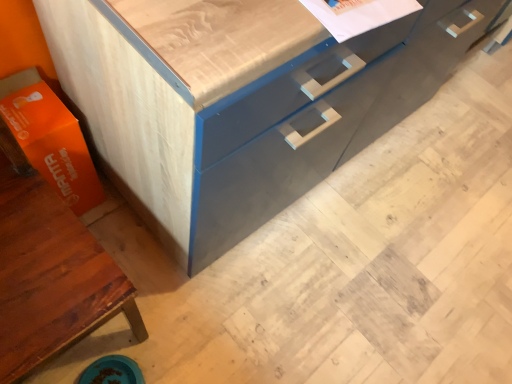
Measure the distance between matte wood cabinet at lower left and camera.

A distance of 28.31 inches exists between matte wood cabinet at lower left and camera.

What do you see at coordinates (242, 109) in the screenshot? I see `matte gray cabinet at center` at bounding box center [242, 109].

Identify the location of orange matte cardboard box at lower left. This screenshot has height=384, width=512. (52, 144).

Considering the sizes of orange matte cardboard box at lower left and matte wood cabinet at lower left in the image, is orange matte cardboard box at lower left bigger or smaller than matte wood cabinet at lower left?

orange matte cardboard box at lower left is smaller than matte wood cabinet at lower left.

Is orange matte cardboard box at lower left aimed at matte wood cabinet at lower left?

No, orange matte cardboard box at lower left is not facing towards matte wood cabinet at lower left.

Considering the relative sizes of orange matte cardboard box at lower left and matte wood cabinet at lower left in the image provided, is orange matte cardboard box at lower left thinner than matte wood cabinet at lower left?

Yes.

In the image, is orange matte cardboard box at lower left on the left side or the right side of matte wood cabinet at lower left?

Clearly, orange matte cardboard box at lower left is on the left of matte wood cabinet at lower left in the image.

Considering the positions of points (42, 81) and (209, 186), is point (42, 81) farther from camera compared to point (209, 186)?

Yes, it is behind point (209, 186).

Can you confirm if orange matte cardboard box at lower left is smaller than matte gray cabinet at center?

Correct, orange matte cardboard box at lower left occupies less space than matte gray cabinet at center.

Is orange matte cardboard box at lower left taller than matte gray cabinet at center?

No, orange matte cardboard box at lower left is not taller than matte gray cabinet at center.

Where is `chest of drawers on the right of orange matte cardboard box at lower left`? The width and height of the screenshot is (512, 384). chest of drawers on the right of orange matte cardboard box at lower left is located at coordinates (242, 109).

From a real-world perspective, is matte gray cabinet at center beneath orange matte cardboard box at lower left?

No, from a real-world perspective, matte gray cabinet at center is not under orange matte cardboard box at lower left.

Considering the sizes of objects matte gray cabinet at center and orange matte cardboard box at lower left in the image provided, who is wider, matte gray cabinet at center or orange matte cardboard box at lower left?

matte gray cabinet at center is wider.

Is matte gray cabinet at center positioned far away from orange matte cardboard box at lower left?

matte gray cabinet at center is actually quite close to orange matte cardboard box at lower left.

Considering the sizes of objects matte wood cabinet at lower left and orange matte cardboard box at lower left in the image provided, who is bigger, matte wood cabinet at lower left or orange matte cardboard box at lower left?

matte wood cabinet at lower left is bigger.

Are matte wood cabinet at lower left and orange matte cardboard box at lower left located far from each other?

No, matte wood cabinet at lower left is not far away from orange matte cardboard box at lower left.

Which object is thinner, matte wood cabinet at lower left or orange matte cardboard box at lower left?

With smaller width is orange matte cardboard box at lower left.

Considering the points (65, 344) and (34, 109), which point is in front, point (65, 344) or point (34, 109)?

The point (65, 344) is in front.

Can you confirm if matte wood cabinet at lower left is bigger than matte gray cabinet at center?

Actually, matte wood cabinet at lower left might be smaller than matte gray cabinet at center.

How different are the orientations of matte wood cabinet at lower left and matte gray cabinet at center in degrees?

They differ by 0.465 degrees in their facing directions.

Considering the relative sizes of matte wood cabinet at lower left and matte gray cabinet at center in the image provided, is matte wood cabinet at lower left wider than matte gray cabinet at center?

No, matte wood cabinet at lower left is not wider than matte gray cabinet at center.

From a real-world perspective, is matte wood cabinet at lower left above or below matte gray cabinet at center?

matte wood cabinet at lower left is situated higher than matte gray cabinet at center in the real world.

Considering the positions of objects matte gray cabinet at center and matte wood cabinet at lower left in the image provided, who is more to the right, matte gray cabinet at center or matte wood cabinet at lower left?

Positioned to the right is matte gray cabinet at center.

Is matte gray cabinet at center spatially inside matte wood cabinet at lower left, or outside of it?

matte gray cabinet at center is not inside matte wood cabinet at lower left, it's outside.

From the image's perspective, which is above, matte gray cabinet at center or matte wood cabinet at lower left?

matte gray cabinet at center is shown above in the image.

The width and height of the screenshot is (512, 384). Identify the location of cardboard box behind the matte wood cabinet at lower left. (52, 144).

There is a orange matte cardboard box at lower left. At what (x,y) coordinates should I click in order to perform the action: click on the chest of drawers above it (from a real-world perspective). Please return your answer as a coordinate pair (x, y). Looking at the image, I should click on (242, 109).

Considering their positions, is matte wood cabinet at lower left positioned closer to orange matte cardboard box at lower left than matte gray cabinet at center?

Based on the image, matte wood cabinet at lower left appears to be nearer to orange matte cardboard box at lower left.

Based on their spatial positions, is matte gray cabinet at center or orange matte cardboard box at lower left further from matte wood cabinet at lower left?

matte gray cabinet at center is further to matte wood cabinet at lower left.

Estimate the real-world distances between objects in this image. Which object is further from matte wood cabinet at lower left, orange matte cardboard box at lower left or matte gray cabinet at center?

matte gray cabinet at center is further to matte wood cabinet at lower left.

Looking at this image, which object lies nearer to the anchor point matte gray cabinet at center, matte wood cabinet at lower left or orange matte cardboard box at lower left?

The object closer to matte gray cabinet at center is orange matte cardboard box at lower left.

Based on their spatial positions, is matte gray cabinet at center or matte wood cabinet at lower left closer to orange matte cardboard box at lower left?

matte wood cabinet at lower left is closer to orange matte cardboard box at lower left.

Based on their spatial positions, is orange matte cardboard box at lower left or matte wood cabinet at lower left further from matte gray cabinet at center?

The object further to matte gray cabinet at center is matte wood cabinet at lower left.

The width and height of the screenshot is (512, 384). I want to click on cabinetry between orange matte cardboard box at lower left and matte gray cabinet at center, so click(51, 278).